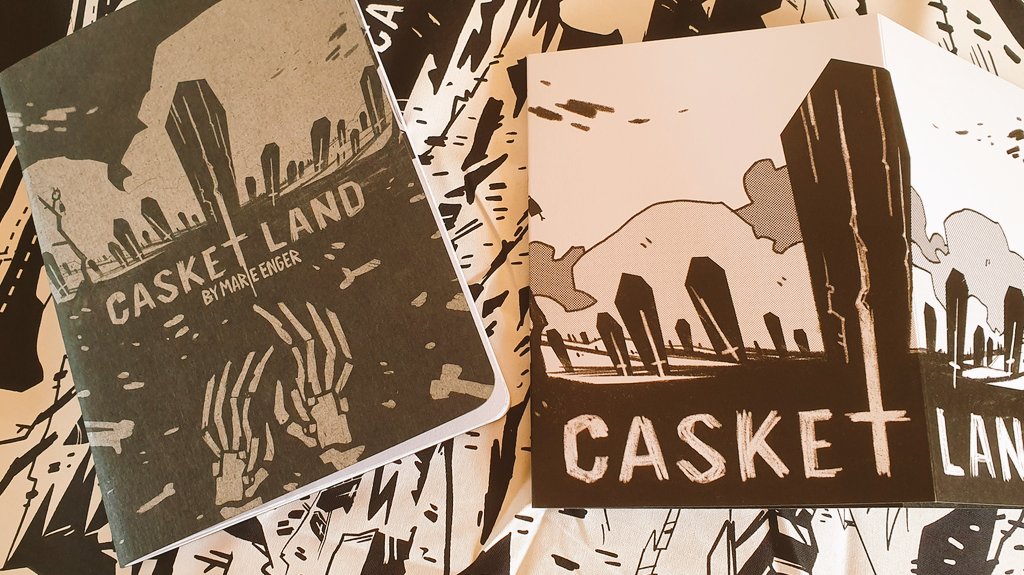
You are a GUI agent. You are given a task and a screenshot of the screen. Output one action in this format:
    pyautogui.click(x=<x>, y=<y>)
    Task: Click on the book
    This screenshot has height=575, width=1024.
    Given the screenshot: What is the action you would take?
    pyautogui.click(x=131, y=528), pyautogui.click(x=880, y=322)